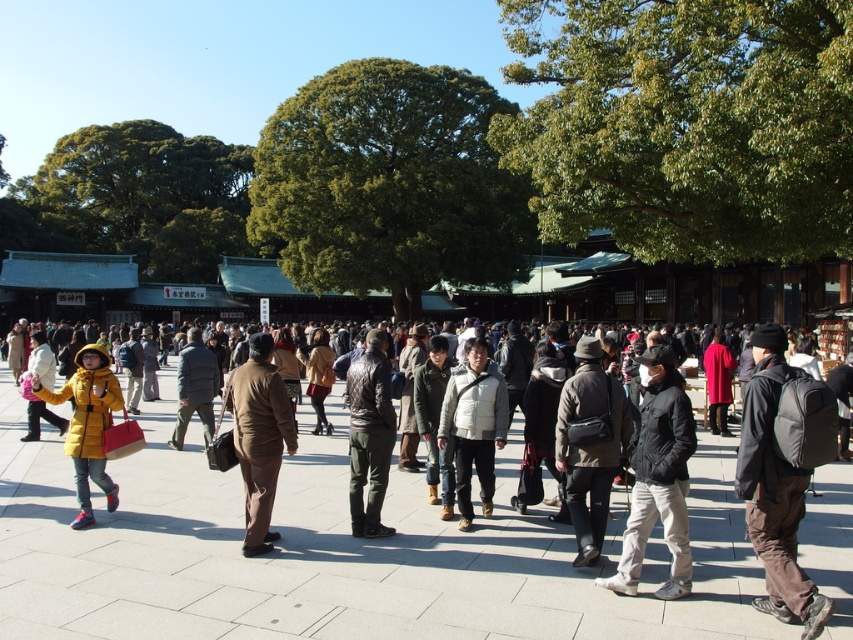
Question: Does dark gray backpack at lower right have a larger size compared to black matte jacket at center?

Choices:
 (A) yes
 (B) no

Answer: (A)

Question: Which of the following is the farthest from the observer?

Choices:
 (A) (729, 380)
 (B) (825, 400)
 (C) (490, 548)

Answer: (A)

Question: Which point appears farthest from the camera in this image?

Choices:
 (A) (245, 547)
 (B) (320, 419)
 (C) (556, 460)

Answer: (B)

Question: Can you confirm if black matte jacket at center is positioned below light brown leather jacket at center?

Choices:
 (A) yes
 (B) no

Answer: (B)

Question: Can you confirm if dark gray backpack at lower right is positioned to the left of black matte jacket at center?

Choices:
 (A) no
 (B) yes

Answer: (A)

Question: Which object is farther from the camera taking this photo?

Choices:
 (A) light brown leather jacket at center
 (B) matte red robe at center
 (C) brown leather jacket at center
 (D) dark brown leather bag at center

Answer: (B)